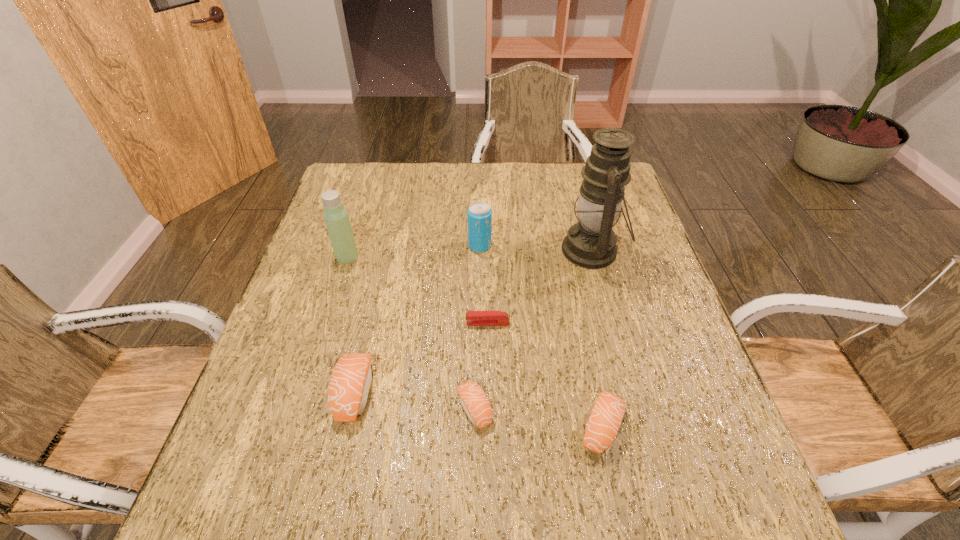
Where is `the second object from left to right`? This screenshot has height=540, width=960. the second object from left to right is located at coordinates (350, 382).

Locate an element on the screen. This screenshot has width=960, height=540. the fourth shortest object is located at coordinates (350, 382).

Locate an element on the screen. The image size is (960, 540). the shortest sushi is located at coordinates (472, 398).

Identify the location of the fifth tallest object. (603, 424).

At what (x,y) coordinates should I click in order to perform the action: click on the rightmost sushi. Please return your answer as a coordinate pair (x, y). The image size is (960, 540). Looking at the image, I should click on (603, 424).

Identify the location of oil lamp. (591, 243).

Where is `the leftmost object`? the leftmost object is located at coordinates (337, 221).

I want to click on thermos bottle, so click(x=337, y=221).

Locate an element on the screen. soda can is located at coordinates (479, 214).

Image resolution: width=960 pixels, height=540 pixels. In order to click on stapler in this screenshot , I will do `click(473, 318)`.